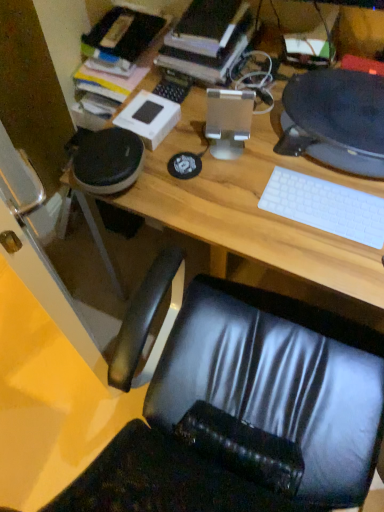
Locate an element on the screen. This screenshot has width=384, height=512. vacant location below white matte keyboard at right (from a real-world perspective) is located at coordinates (323, 209).